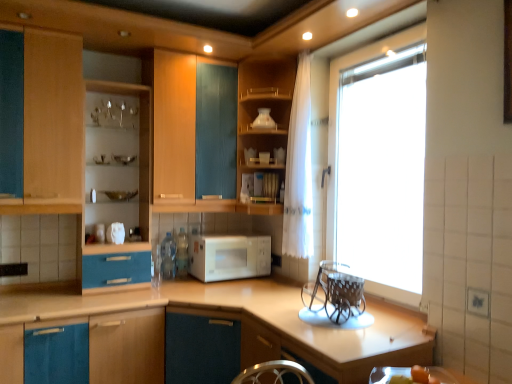
Question: Is blue matte cabinet at lower left, which ranks as the third cabinetry in right-to-left order, behind matte wood shelves at center, which ranks as the second cabinetry in right-to-left order?

Choices:
 (A) no
 (B) yes

Answer: (A)

Question: Can you confirm if blue matte cabinet at lower left, which ranks as the third cabinetry in right-to-left order, is positioned to the left of matte wood shelves at center, acting as the second cabinetry starting from the left?

Choices:
 (A) no
 (B) yes

Answer: (B)

Question: Is blue matte cabinet at lower left, which ranks as the third cabinetry in right-to-left order, wider than matte wood shelves at center, which ranks as the second cabinetry in right-to-left order?

Choices:
 (A) yes
 (B) no

Answer: (A)

Question: From a real-world perspective, is blue matte cabinet at lower left, the first cabinetry viewed from the left, beneath matte wood shelves at center, which ranks as the second cabinetry in right-to-left order?

Choices:
 (A) no
 (B) yes

Answer: (B)

Question: From the image's perspective, is blue matte cabinet at lower left, which ranks as the third cabinetry in right-to-left order, over matte wood shelves at center, acting as the second cabinetry starting from the left?

Choices:
 (A) yes
 (B) no

Answer: (B)

Question: Is blue matte cabinet at lower left, which ranks as the third cabinetry in right-to-left order, outside matte wood shelves at center, acting as the second cabinetry starting from the left?

Choices:
 (A) no
 (B) yes

Answer: (B)

Question: Is matte wood shelves at center, acting as the second cabinetry starting from the left, outside of transparent glass window at upper right?

Choices:
 (A) no
 (B) yes

Answer: (B)

Question: Is transparent glass window at upper right inside matte wood shelves at center, which ranks as the second cabinetry in right-to-left order?

Choices:
 (A) yes
 (B) no

Answer: (B)

Question: Does matte wood shelves at center, acting as the second cabinetry starting from the left, have a greater height compared to transparent glass window at upper right?

Choices:
 (A) yes
 (B) no

Answer: (B)

Question: Is matte wood shelves at center, acting as the second cabinetry starting from the left, smaller than transparent glass window at upper right?

Choices:
 (A) no
 (B) yes

Answer: (A)

Question: Does matte wood shelves at center, acting as the second cabinetry starting from the left, turn towards transparent glass window at upper right?

Choices:
 (A) yes
 (B) no

Answer: (B)

Question: Is white glossy vase at upper center, which is counted as the 1th appliance, starting from the back, to the right of matte wood shelves at center, acting as the second cabinetry starting from the left, from the viewer's perspective?

Choices:
 (A) yes
 (B) no

Answer: (A)